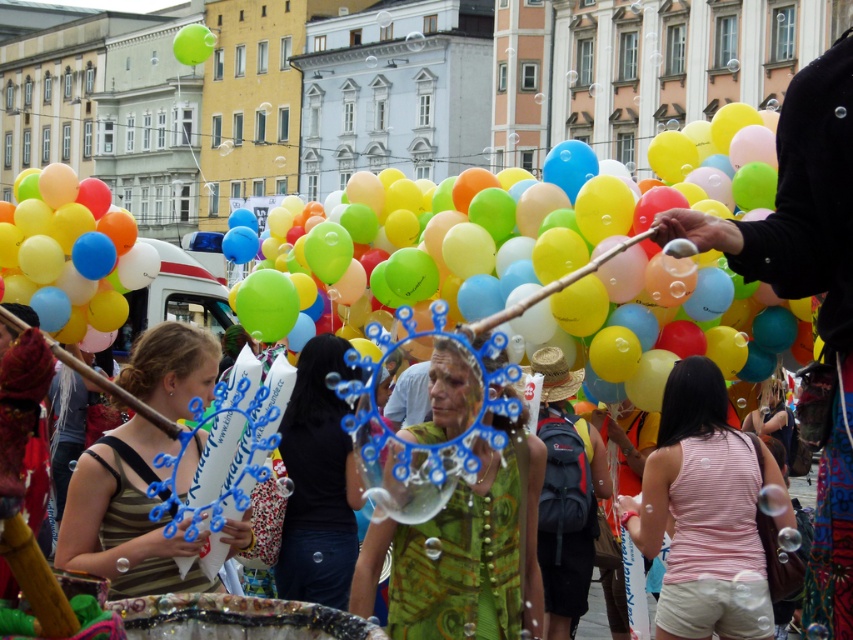
Who is shorter, rubber balloons at center or straw hat at center?

Standing shorter between the two is straw hat at center.

Which is above, rubber balloons at center or straw hat at center?

rubber balloons at center is above.

You are a GUI agent. You are given a task and a screenshot of the screen. Output one action in this format:
    pyautogui.click(x=<x>, y=<y>)
    Task: Click on the rubber balloons at center
    The width and height of the screenshot is (853, 640).
    Given the screenshot: What is the action you would take?
    pyautogui.click(x=670, y=292)

Identify the location of rubber balloons at center. The height and width of the screenshot is (640, 853). pyautogui.click(x=670, y=292).

Which is in front, point (845, 401) or point (181, 51)?

Positioned in front is point (845, 401).

The width and height of the screenshot is (853, 640). What are the coordinates of `black fabric at upper right` in the screenshot? It's located at pyautogui.click(x=809, y=294).

Locate an element on the screen. black fabric at upper right is located at coordinates (809, 294).

Is black fabric at upper right positioned in front of straw hat at center?

Yes, it is in front of straw hat at center.

Who is shorter, black fabric at upper right or straw hat at center?

With less height is straw hat at center.

Is point (822, 314) farther from camera compared to point (564, 404)?

That is False.

The image size is (853, 640). Identify the location of black fabric at upper right. (809, 294).